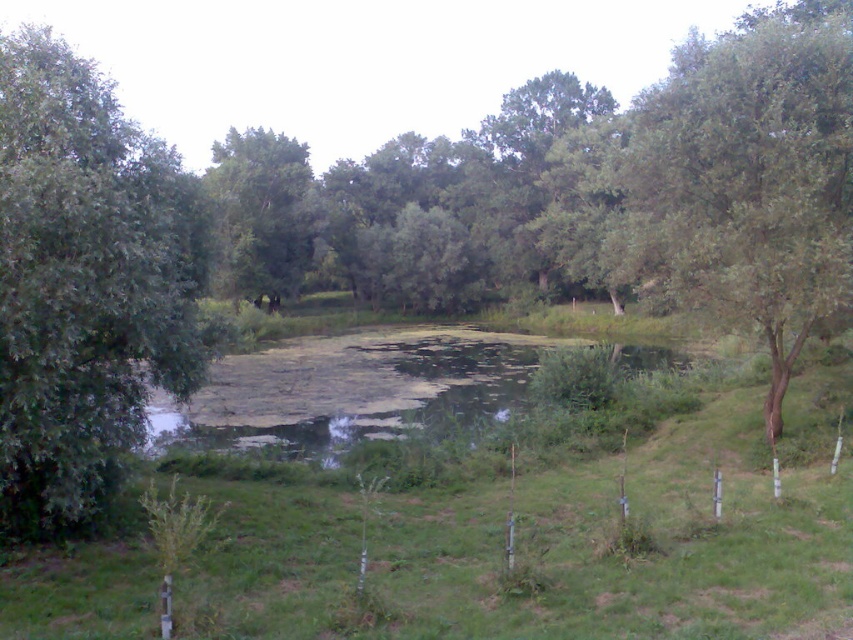
Question: Is green leafy tree at left thinner than green leafy tree at center?

Choices:
 (A) no
 (B) yes

Answer: (B)

Question: Is green leafy tree at left positioned at the back of green leafy tree at center?

Choices:
 (A) yes
 (B) no

Answer: (B)

Question: Which of the following is the closest to the observer?

Choices:
 (A) (242, 294)
 (B) (68, 200)

Answer: (B)

Question: Is green leafy tree at left wider than green leafy tree at center?

Choices:
 (A) no
 (B) yes

Answer: (A)